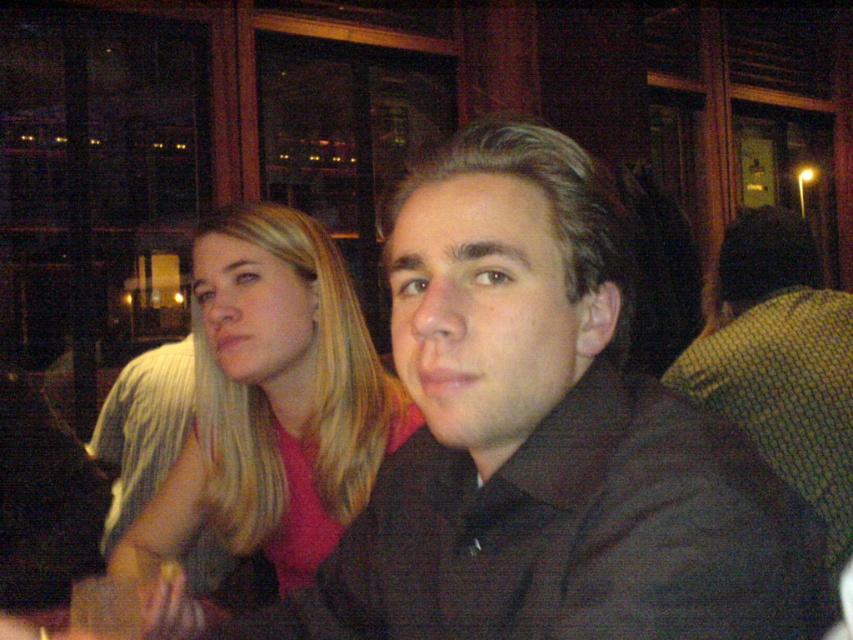
Question: Which point is closer to the camera taking this photo?

Choices:
 (A) (311, 497)
 (B) (737, 346)
 (C) (422, 410)

Answer: (C)

Question: Which object is the farthest from the blonde hair at left?

Choices:
 (A) black matte shirt at center
 (B) matte black shirt at center

Answer: (A)

Question: Is matte black shirt at center positioned at the back of black matte shirt at center?

Choices:
 (A) no
 (B) yes

Answer: (A)

Question: Does matte black shirt at center appear over black matte shirt at center?

Choices:
 (A) no
 (B) yes

Answer: (A)

Question: Which point is closer to the camera taking this photo?

Choices:
 (A) (399, 404)
 (B) (561, 182)
 (C) (741, 333)

Answer: (B)

Question: From the image, what is the correct spatial relationship of blonde hair at left in relation to black matte shirt at center?

Choices:
 (A) left
 (B) right

Answer: (A)